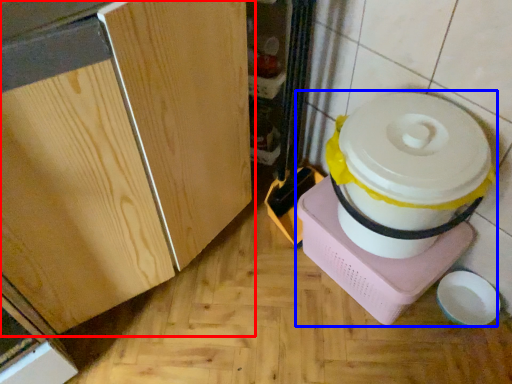
Question: Which of the following is the farthest to the observer, cabinetry (highlighted by a red box) or appliance (highlighted by a blue box)?

Choices:
 (A) cabinetry
 (B) appliance

Answer: (B)